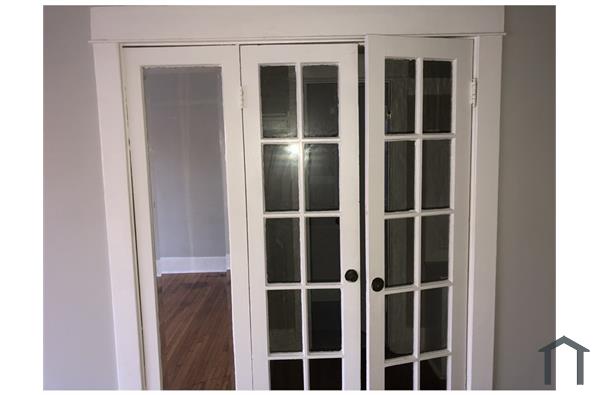
Image resolution: width=600 pixels, height=395 pixels. Find the location of `window`. window is located at coordinates (281, 90).